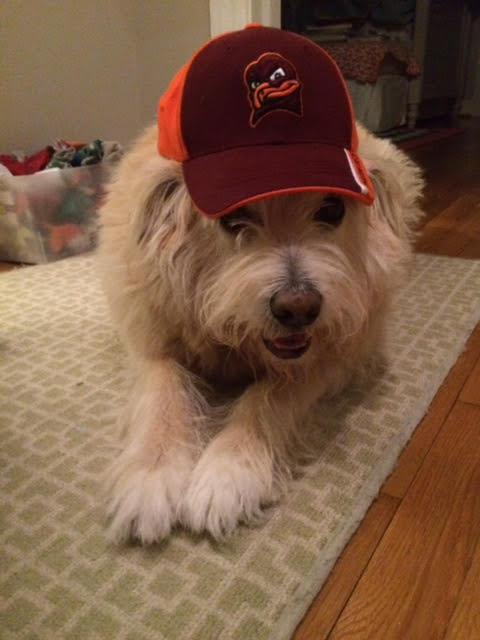
Locate an element on the screen. This screenshot has width=480, height=640. blanket is located at coordinates (363, 60).